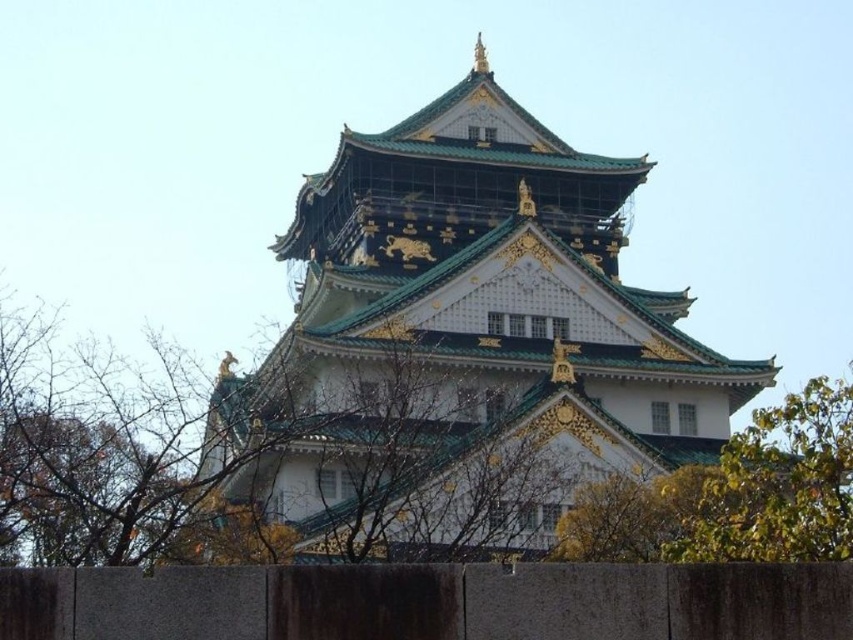
Question: Considering the real-world distances, which object is closest to the green matte tower at center?

Choices:
 (A) green leafy tree at right
 (B) green leafy tree at center

Answer: (B)

Question: Does green matte tower at center have a lesser width compared to green leafy tree at right?

Choices:
 (A) no
 (B) yes

Answer: (A)

Question: Which of the following is the closest to the observer?

Choices:
 (A) green leafy tree at center
 (B) green leafy tree at right
 (C) green matte tower at center

Answer: (B)

Question: Observing the image, what is the correct spatial positioning of green matte tower at center in reference to green leafy tree at center?

Choices:
 (A) above
 (B) below

Answer: (A)

Question: Which of these objects is positioned closest to the green leafy tree at right?

Choices:
 (A) green leafy tree at center
 (B) green matte tower at center

Answer: (A)

Question: Is green matte tower at center above green leafy tree at center?

Choices:
 (A) yes
 (B) no

Answer: (A)